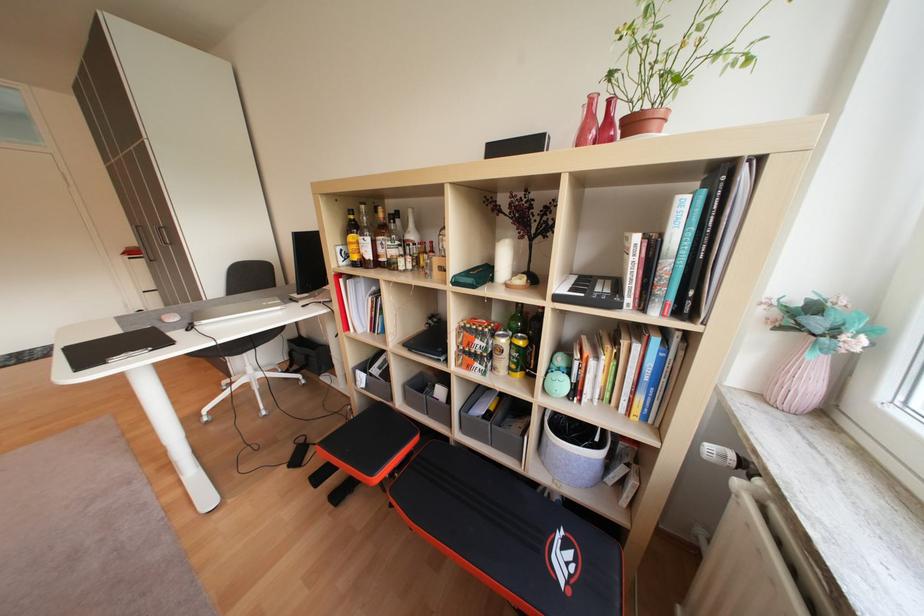
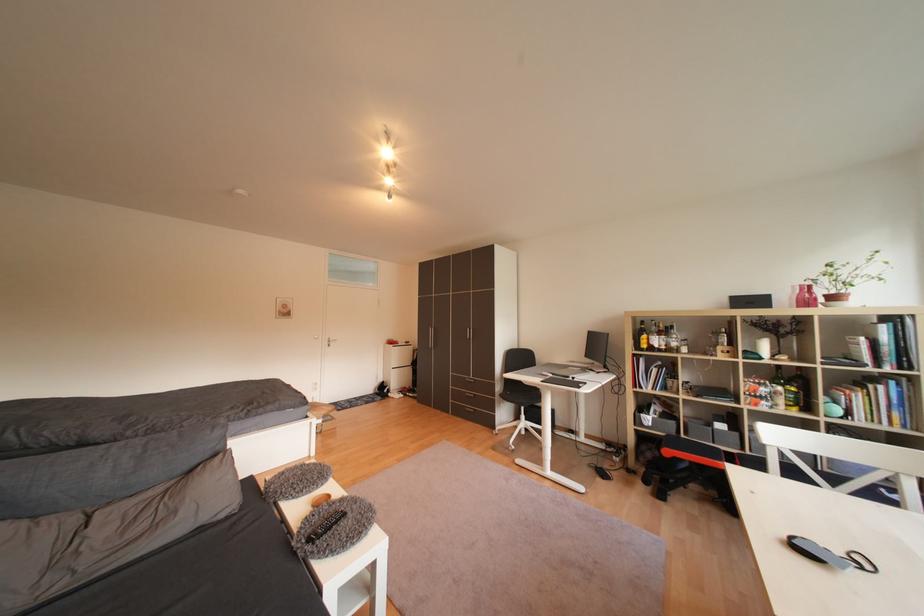
Which direction would the cameraman need to move to produce the second image?

The cameraman walked toward left, backward.